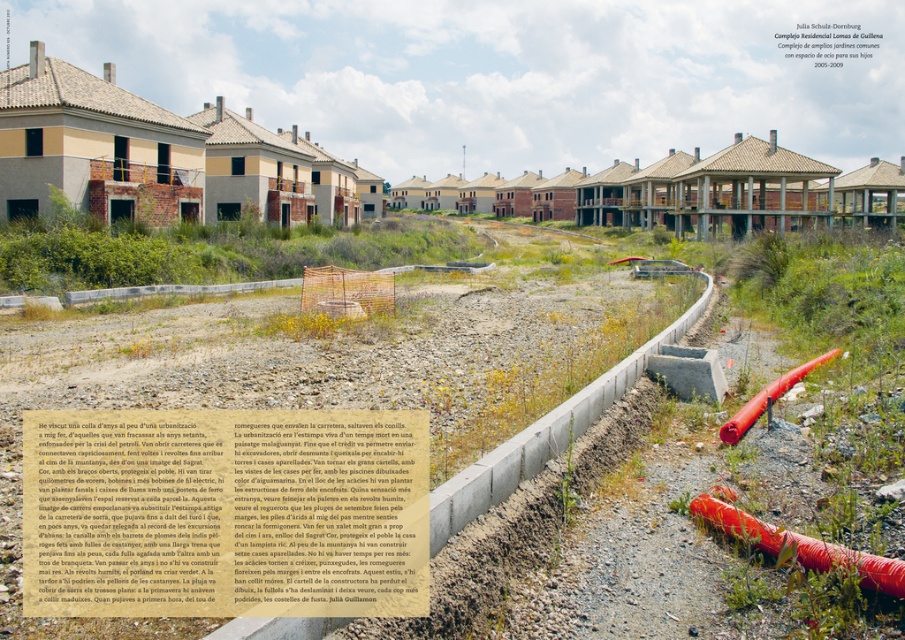
Question: Can you confirm if rubber hose at center is positioned to the right of red rubber hose at center right?

Choices:
 (A) no
 (B) yes

Answer: (A)

Question: Does rubber hose at center appear on the right side of red rubber hose at center right?

Choices:
 (A) yes
 (B) no

Answer: (B)

Question: Which point is farther to the camera?

Choices:
 (A) (787, 387)
 (B) (772, 552)

Answer: (A)

Question: Which object appears farthest from the camera in this image?

Choices:
 (A) red rubber hose at center right
 (B) rubber hose at center

Answer: (A)

Question: Can you confirm if rubber hose at center is positioned above red rubber hose at center right?

Choices:
 (A) yes
 (B) no

Answer: (B)